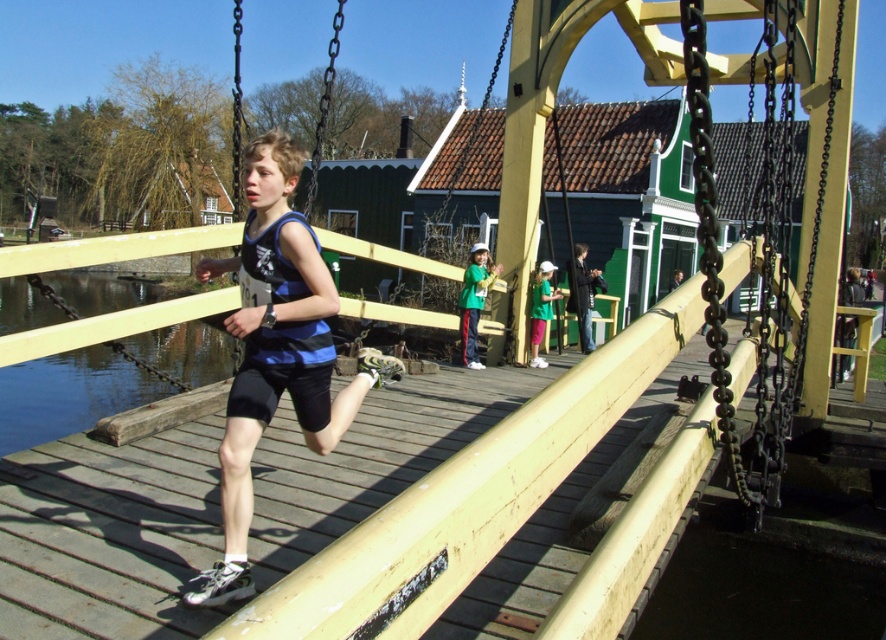
Which is more to the right, green matte shirt at center or dark blue fabric jacket at center?

From the viewer's perspective, dark blue fabric jacket at center appears more on the right side.

Find the location of a particular element. This screenshot has width=886, height=640. green matte shirt at center is located at coordinates (473, 300).

This screenshot has width=886, height=640. Identify the location of green matte shirt at center. (473, 300).

This screenshot has width=886, height=640. Find the location of `green matte shirt at center`. green matte shirt at center is located at coordinates (473, 300).

Which of these two, green matte shirt at center or green fabric cap at center, stands taller?

green matte shirt at center is taller.

Which is more to the left, green matte shirt at center or green fabric cap at center?

green matte shirt at center is more to the left.

The image size is (886, 640). Describe the element at coordinates (473, 300) in the screenshot. I see `green matte shirt at center` at that location.

In order to click on green matte shirt at center in this screenshot , I will do `click(473, 300)`.

Who is positioned more to the right, green fabric cap at center or blue fabric shirt at center?

Positioned to the right is blue fabric shirt at center.

Is point (534, 326) closer to viewer compared to point (679, 273)?

Yes, point (534, 326) is closer to viewer.

Where is `green fabric cap at center`? green fabric cap at center is located at coordinates [541, 308].